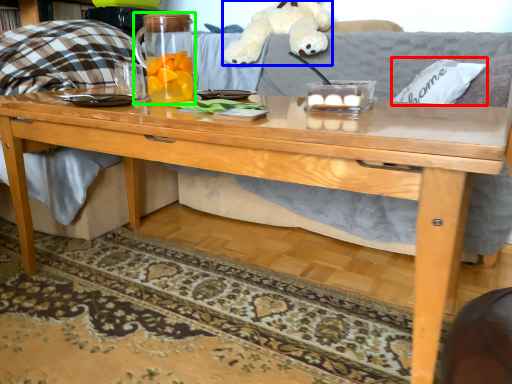
Question: Based on their relative distances, which object is nearer to pillow (highlighted by a red box)? Choose from toy (highlighted by a blue box) and beverage (highlighted by a green box).

Choices:
 (A) toy
 (B) beverage

Answer: (A)